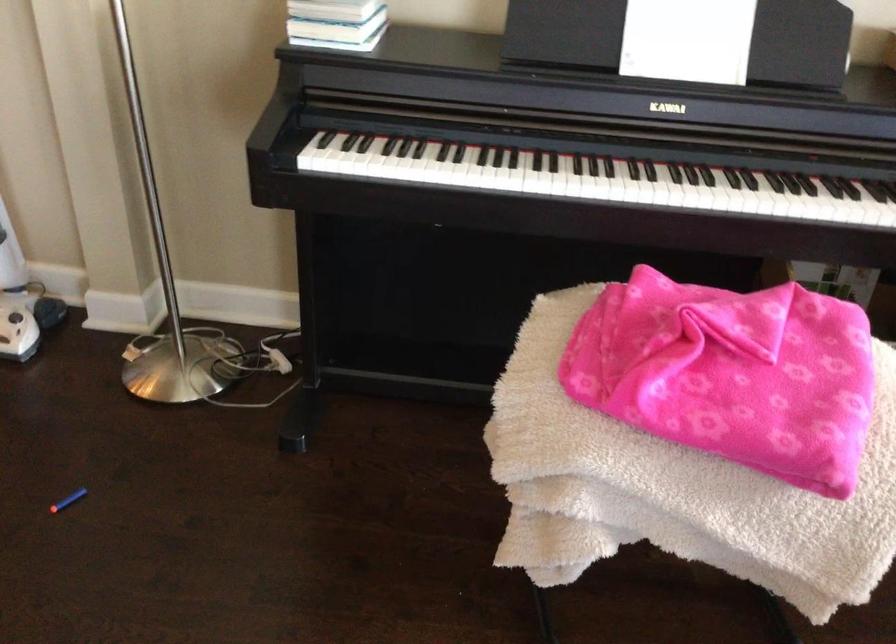
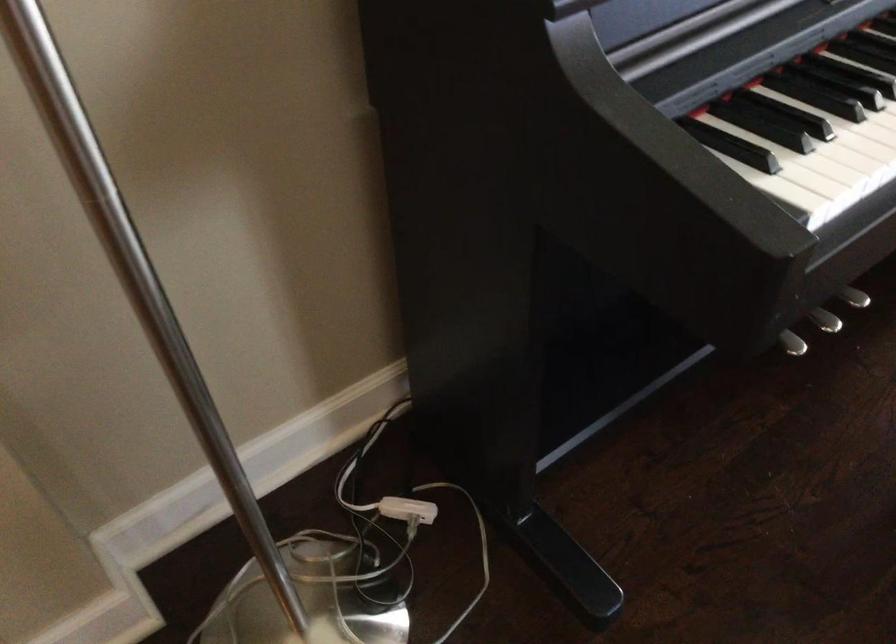
The point at (380,140) is marked in the first image. Where is the corresponding point in the second image?

(799, 100)